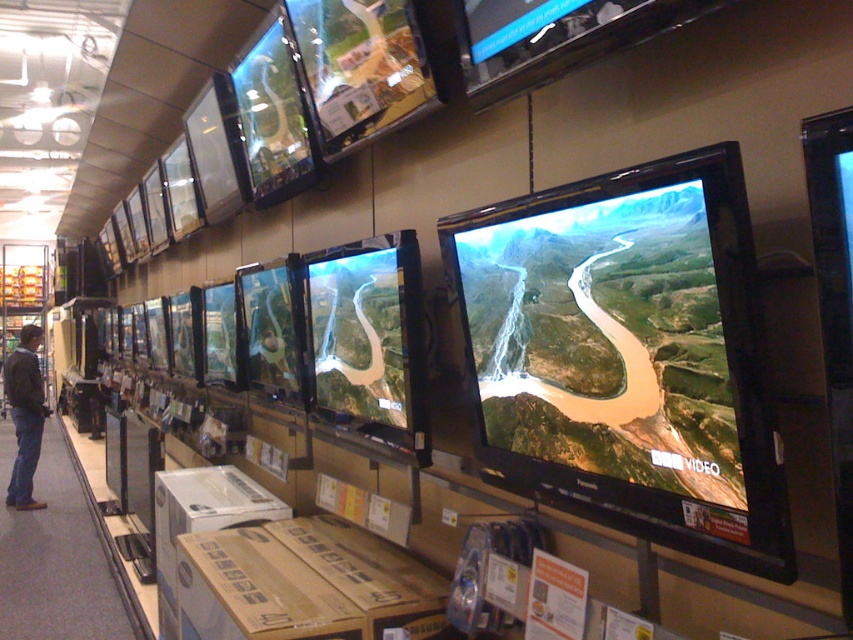
Does satin black flat screen at center have a larger size compared to dark gray jacket at left?

No, satin black flat screen at center is not bigger than dark gray jacket at left.

Who is more forward, (x=697, y=525) or (x=39, y=332)?

Point (x=697, y=525)

Where is `satin black flat screen at center`? satin black flat screen at center is located at coordinates (627, 355).